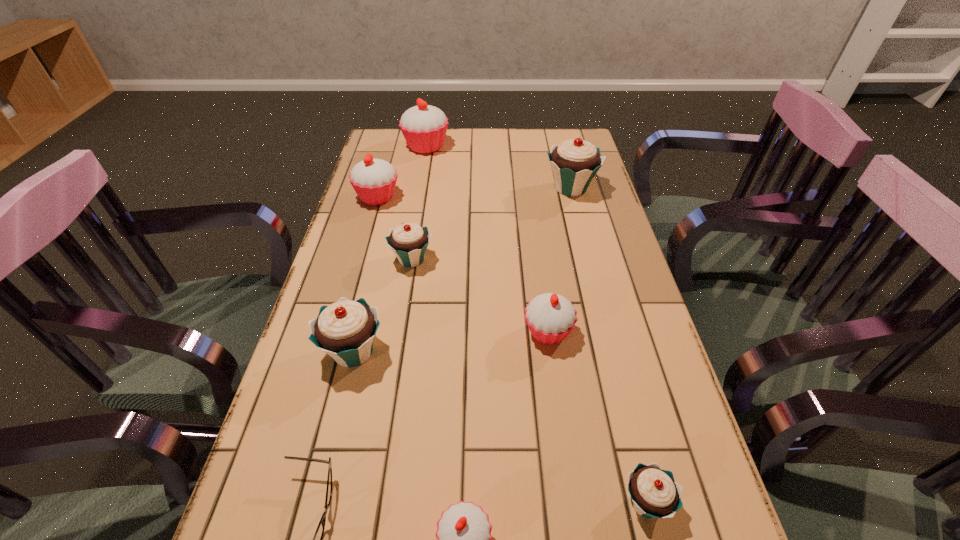
Find the location of a particular element. Image resolution: width=960 pixels, height=540 pixels. the farthest object is located at coordinates (424, 127).

Find the location of a particular element. the biggest pink cupcake is located at coordinates (424, 127).

The width and height of the screenshot is (960, 540). Find the location of `the biggest teal cupcake`. the biggest teal cupcake is located at coordinates (574, 163).

The image size is (960, 540). Find the location of `the second biggest pink cupcake`. the second biggest pink cupcake is located at coordinates (374, 180).

Find the location of a particular element. The image size is (960, 540). the third farthest teal cupcake is located at coordinates (345, 330).

Locate an element on the screen. The width and height of the screenshot is (960, 540). the second nearest pink cupcake is located at coordinates (550, 317).

Identify the location of the rightmost pink cupcake. The image size is (960, 540). (550, 317).

Where is `the fifth nearest cupcake`? The width and height of the screenshot is (960, 540). the fifth nearest cupcake is located at coordinates [x=409, y=241].

At what (x,y) coordinates should I click in order to perform the action: click on the third nearest teal cupcake. Please return your answer as a coordinate pair (x, y). The width and height of the screenshot is (960, 540). Looking at the image, I should click on (409, 241).

Locate an element on the screen. the smallest teal cupcake is located at coordinates (654, 493).